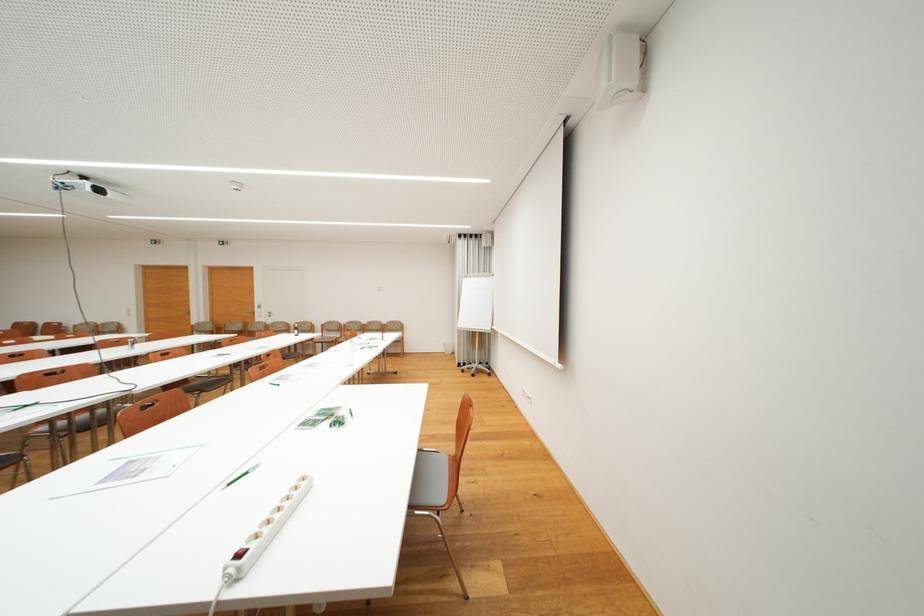
You are a GUI agent. You are given a task and a screenshot of the screen. Output one action in this format:
    pyautogui.click(x=<x>, y=<y>)
    Task: Click on the orange chair sitting surface
    The width and height of the screenshot is (924, 616).
    Given the screenshot: What is the action you would take?
    pyautogui.click(x=431, y=467)